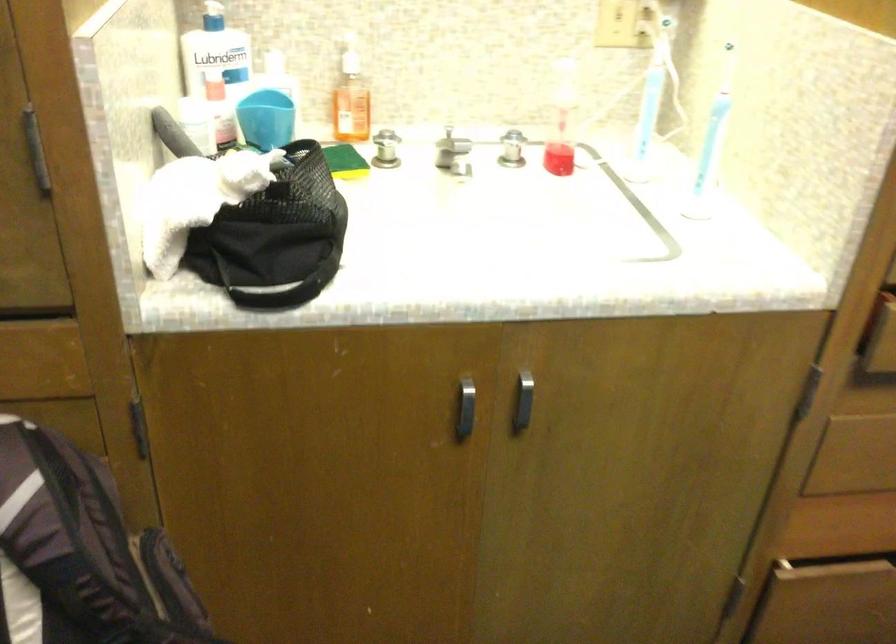
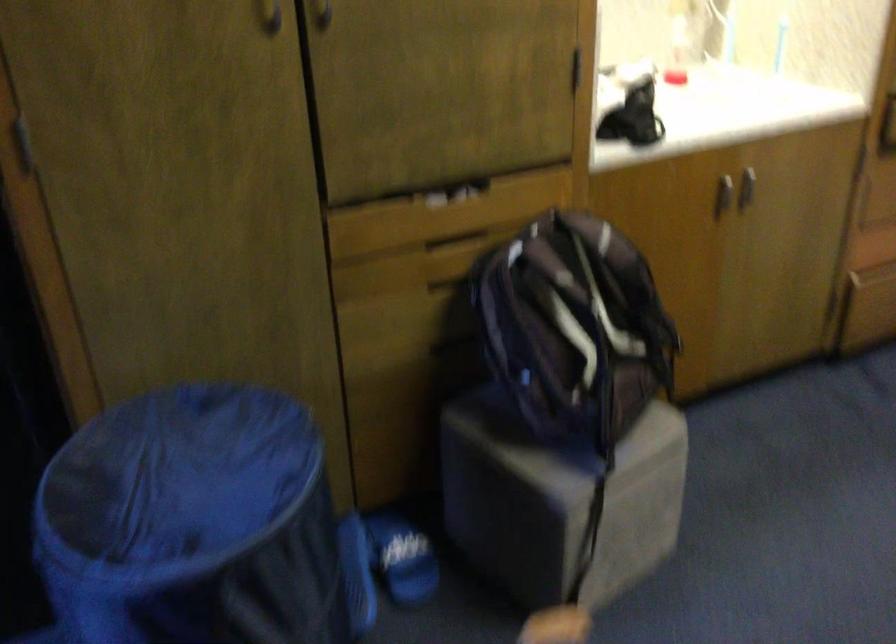
Locate, in the second image, the point that corresponds to [528,408] in the first image.

(746, 187)